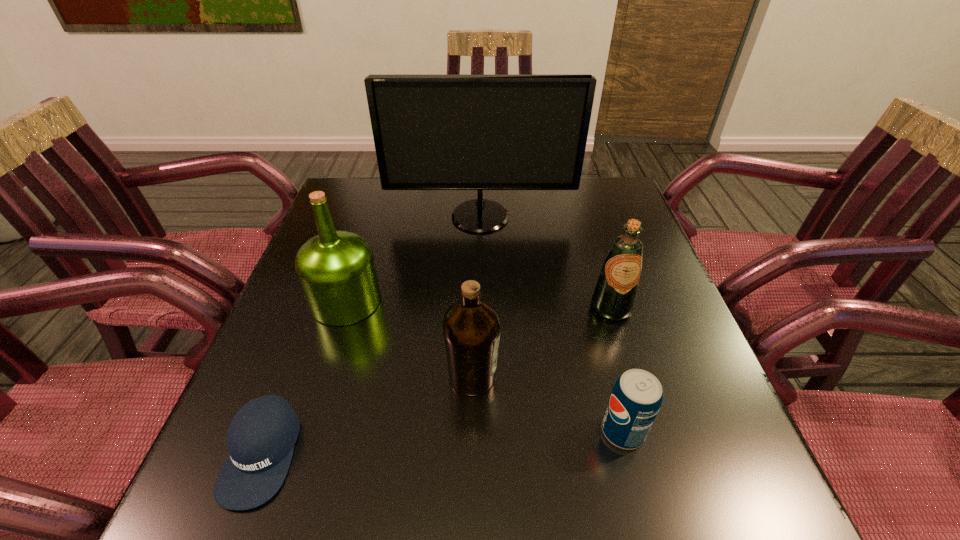
Identify the location of vacant area located on the label of the second olive oil from left to right. (576, 376).

Identify the location of vacant space located 0.180m on the front-facing side of the rightmost olive oil. This screenshot has width=960, height=540. (638, 395).

The image size is (960, 540). Identify the location of free space located on the left of the second shortest object. (396, 431).

Where is `object that is at the far edge`? The image size is (960, 540). object that is at the far edge is located at coordinates (431, 132).

You are a GUI agent. You are given a task and a screenshot of the screen. Output one action in this format:
    pyautogui.click(x=<x>, y=<y>)
    Task: Click on the object present at the near edge
    Image resolution: width=960 pixels, height=540 pixels.
    Given the screenshot: What is the action you would take?
    pyautogui.click(x=260, y=440)

I want to click on olive oil at the left edge, so (x=336, y=270).

You are a GUI agent. You are given a task and a screenshot of the screen. Output one action in this format:
    pyautogui.click(x=<x>, y=<y>)
    Task: Click on the baseball cap that is at the left edge
    
    Given the screenshot: What is the action you would take?
    pyautogui.click(x=260, y=440)

You are a GUI agent. You are given a task and a screenshot of the screen. Output one action in this format:
    pyautogui.click(x=<x>, y=<y>)
    Task: Click on the olive oil located at the right edge
    The width and height of the screenshot is (960, 540).
    Given the screenshot: What is the action you would take?
    point(614,296)

Identify the location of pop that is at the right edge. The image size is (960, 540). (636, 398).

This screenshot has width=960, height=540. Identify the location of object that is at the near left corner. (260, 440).